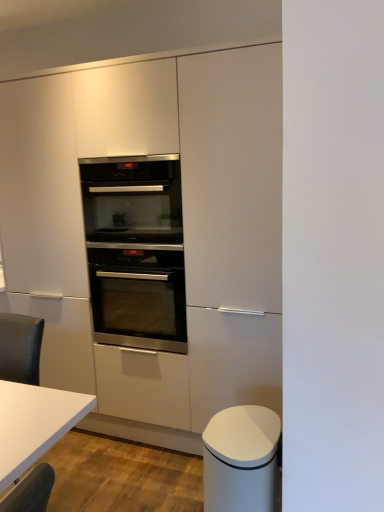
Where is `stainless steel oven at center, which appears as the first oven when viewed from the top`? This screenshot has width=384, height=512. stainless steel oven at center, which appears as the first oven when viewed from the top is located at coordinates (132, 199).

This screenshot has height=512, width=384. What do you see at coordinates (34, 423) in the screenshot? I see `white glossy table at lower left` at bounding box center [34, 423].

Locate an element on the screen. Image resolution: width=384 pixels, height=512 pixels. white matte trash can at lower right, marked as the 2th cabinetry in a back-to-front arrangement is located at coordinates (241, 460).

Between satin white cabinet at center, the first cabinetry when ordered from back to front, and stainless steel oven at center, which ranks as the second oven in bottom-to-top order, which one appears on the left side from the viewer's perspective?

stainless steel oven at center, which ranks as the second oven in bottom-to-top order.

Could you measure the distance between satin white cabinet at center, the first cabinetry when ordered from back to front, and stainless steel oven at center, which ranks as the second oven in bottom-to-top order?

A distance of 10.11 inches exists between satin white cabinet at center, the first cabinetry when ordered from back to front, and stainless steel oven at center, which ranks as the second oven in bottom-to-top order.

Considering their positions, is satin white cabinet at center, the 2th cabinetry viewed from the front, located in front of or behind stainless steel oven at center, which appears as the first oven when viewed from the top?

satin white cabinet at center, the 2th cabinetry viewed from the front, is positioned closer to the viewer than stainless steel oven at center, which appears as the first oven when viewed from the top.

Is stainless steel oven at center, which ranks as the second oven in bottom-to-top order, at the back of satin white cabinet at center, the 2th cabinetry viewed from the front?

Yes, stainless steel oven at center, which ranks as the second oven in bottom-to-top order, is at the back of satin white cabinet at center, the 2th cabinetry viewed from the front.

Considering the sizes of objects stainless steel oven at center, acting as the second oven starting from the top, and satin white cabinet at center, the first cabinetry when ordered from back to front, in the image provided, who is taller, stainless steel oven at center, acting as the second oven starting from the top, or satin white cabinet at center, the first cabinetry when ordered from back to front,?

With more height is satin white cabinet at center, the first cabinetry when ordered from back to front.

Considering their positions, is stainless steel oven at center, acting as the second oven starting from the top, located in front of or behind satin white cabinet at center, the 2th cabinetry viewed from the front?

Clearly, stainless steel oven at center, acting as the second oven starting from the top, is behind satin white cabinet at center, the 2th cabinetry viewed from the front.

Which of these two, stainless steel oven at center, positioned as the 1th oven in bottom-to-top order, or satin white cabinet at center, the 2th cabinetry viewed from the front, is wider?

Wider between the two is satin white cabinet at center, the 2th cabinetry viewed from the front.

At what (x,y) coordinates should I click in order to perform the action: click on oven in front of the stainless steel oven at center, positioned as the 1th oven in bottom-to-top order. Please return your answer as a coordinate pair (x, y). The width and height of the screenshot is (384, 512). Looking at the image, I should click on (132, 199).

From a real-world perspective, does stainless steel oven at center, acting as the second oven starting from the top, stand above stainless steel oven at center, which appears as the first oven when viewed from the top?

No, from a real-world perspective, stainless steel oven at center, acting as the second oven starting from the top, is not over stainless steel oven at center, which appears as the first oven when viewed from the top

From the image's perspective, which one is positioned higher, stainless steel oven at center, positioned as the 1th oven in bottom-to-top order, or stainless steel oven at center, which ranks as the second oven in bottom-to-top order?

stainless steel oven at center, which ranks as the second oven in bottom-to-top order.

What's the angular difference between stainless steel oven at center, positioned as the 1th oven in bottom-to-top order, and stainless steel oven at center, which appears as the first oven when viewed from the top,'s facing directions?

The angular difference between stainless steel oven at center, positioned as the 1th oven in bottom-to-top order, and stainless steel oven at center, which appears as the first oven when viewed from the top, is 0.0645 degrees.

Find the location of `oven that appears below the stainless steel oven at center, which ranks as the second oven in bottom-to-top order (from the image's perspective)`. oven that appears below the stainless steel oven at center, which ranks as the second oven in bottom-to-top order (from the image's perspective) is located at coordinates (138, 295).

Is stainless steel oven at center, which appears as the first oven when viewed from the top, taller than stainless steel oven at center, acting as the second oven starting from the top?

Incorrect, the height of stainless steel oven at center, which appears as the first oven when viewed from the top, is not larger of that of stainless steel oven at center, acting as the second oven starting from the top.

Which object is more forward, stainless steel oven at center, which appears as the first oven when viewed from the top, or stainless steel oven at center, positioned as the 1th oven in bottom-to-top order?

stainless steel oven at center, which appears as the first oven when viewed from the top, is in front.

How different are the orientations of stainless steel oven at center, which appears as the first oven when viewed from the top, and stainless steel oven at center, positioned as the 1th oven in bottom-to-top order, in degrees?

There is a 0.0645-degree angle between the facing directions of stainless steel oven at center, which appears as the first oven when viewed from the top, and stainless steel oven at center, positioned as the 1th oven in bottom-to-top order.

Which is behind, point (252, 477) or point (212, 376)?

Positioned behind is point (212, 376).

Which of these two, white matte trash can at lower right, the first cabinetry from the front, or satin white cabinet at center, the 2th cabinetry viewed from the front, is thinner?

With smaller width is white matte trash can at lower right, the first cabinetry from the front.

From a real-world perspective, which is physically above, white matte trash can at lower right, marked as the 2th cabinetry in a back-to-front arrangement, or satin white cabinet at center, the first cabinetry when ordered from back to front?

In real-world perspective, satin white cabinet at center, the first cabinetry when ordered from back to front, is above.

Is white matte trash can at lower right, marked as the 2th cabinetry in a back-to-front arrangement, facing towards satin white cabinet at center, the 2th cabinetry viewed from the front?

No.

Consider the image. From the image's perspective, is satin white cabinet at center, the first cabinetry when ordered from back to front, located beneath white glossy table at lower left?

No, from the image's perspective, satin white cabinet at center, the first cabinetry when ordered from back to front, is not below white glossy table at lower left.

Considering the sizes of objects satin white cabinet at center, the first cabinetry when ordered from back to front, and white glossy table at lower left in the image provided, who is wider, satin white cabinet at center, the first cabinetry when ordered from back to front, or white glossy table at lower left?

satin white cabinet at center, the first cabinetry when ordered from back to front, is wider.

How many degrees apart are the facing directions of satin white cabinet at center, the first cabinetry when ordered from back to front, and white glossy table at lower left?

The angle between the facing direction of satin white cabinet at center, the first cabinetry when ordered from back to front, and the facing direction of white glossy table at lower left is 0.893 degrees.

Is the surface of satin white cabinet at center, the first cabinetry when ordered from back to front, in direct contact with white glossy table at lower left?

There is a gap between satin white cabinet at center, the first cabinetry when ordered from back to front, and white glossy table at lower left.

Is white matte trash can at lower right, the first cabinetry from the front, positioned with its back to stainless steel oven at center, positioned as the 1th oven in bottom-to-top order?

No, white matte trash can at lower right, the first cabinetry from the front, is not facing the opposite direction of stainless steel oven at center, positioned as the 1th oven in bottom-to-top order.

What's the angular difference between white matte trash can at lower right, marked as the 2th cabinetry in a back-to-front arrangement, and stainless steel oven at center, positioned as the 1th oven in bottom-to-top order,'s facing directions?

The facing directions of white matte trash can at lower right, marked as the 2th cabinetry in a back-to-front arrangement, and stainless steel oven at center, positioned as the 1th oven in bottom-to-top order, are 90.2 degrees apart.

Which is correct: white matte trash can at lower right, marked as the 2th cabinetry in a back-to-front arrangement, is inside stainless steel oven at center, acting as the second oven starting from the top, or outside of it?

The correct answer is: outside.

From the image's perspective, between white matte trash can at lower right, marked as the 2th cabinetry in a back-to-front arrangement, and stainless steel oven at center, positioned as the 1th oven in bottom-to-top order, who is located below?

From the image's view, white matte trash can at lower right, marked as the 2th cabinetry in a back-to-front arrangement, is below.

From the image's perspective, starting from the stainless steel oven at center, which appears as the first oven when viewed from the top, which cabinetry is the 1st one below? Please provide its 2D coordinates.

[(150, 234)]

The width and height of the screenshot is (384, 512). In order to click on the 1st cabinetry in front of the stainless steel oven at center, acting as the second oven starting from the top in this screenshot , I will do `click(150, 234)`.

In the scene shown: Estimate the real-world distances between objects in this image. Which object is further from stainless steel oven at center, which appears as the first oven when viewed from the top, white matte trash can at lower right, marked as the 2th cabinetry in a back-to-front arrangement, or stainless steel oven at center, positioned as the 1th oven in bottom-to-top order?

Among the two, white matte trash can at lower right, marked as the 2th cabinetry in a back-to-front arrangement, is located further to stainless steel oven at center, which appears as the first oven when viewed from the top.

When comparing their distances from satin white cabinet at center, the 2th cabinetry viewed from the front, does stainless steel oven at center, positioned as the 1th oven in bottom-to-top order, or white matte trash can at lower right, the first cabinetry from the front, seem closer?

Among the two, stainless steel oven at center, positioned as the 1th oven in bottom-to-top order, is located nearer to satin white cabinet at center, the 2th cabinetry viewed from the front.

Based on the photo, based on their spatial positions, is white matte trash can at lower right, the first cabinetry from the front, or stainless steel oven at center, acting as the second oven starting from the top, further from white glossy table at lower left?

stainless steel oven at center, acting as the second oven starting from the top, is positioned further to the anchor white glossy table at lower left.

Estimate the real-world distances between objects in this image. Which object is closer to stainless steel oven at center, which ranks as the second oven in bottom-to-top order, stainless steel oven at center, acting as the second oven starting from the top, or satin white cabinet at center, the 2th cabinetry viewed from the front?

satin white cabinet at center, the 2th cabinetry viewed from the front, lies closer to stainless steel oven at center, which ranks as the second oven in bottom-to-top order, than the other object.

From the image, which object appears to be nearer to satin white cabinet at center, the 2th cabinetry viewed from the front, stainless steel oven at center, which ranks as the second oven in bottom-to-top order, or stainless steel oven at center, positioned as the 1th oven in bottom-to-top order?

stainless steel oven at center, positioned as the 1th oven in bottom-to-top order.

Looking at the image, which one is located closer to satin white cabinet at center, the 2th cabinetry viewed from the front, white glossy table at lower left or white matte trash can at lower right, marked as the 2th cabinetry in a back-to-front arrangement?

The object closer to satin white cabinet at center, the 2th cabinetry viewed from the front, is white matte trash can at lower right, marked as the 2th cabinetry in a back-to-front arrangement.

From the image, which object appears to be nearer to white matte trash can at lower right, marked as the 2th cabinetry in a back-to-front arrangement, stainless steel oven at center, which ranks as the second oven in bottom-to-top order, or satin white cabinet at center, the first cabinetry when ordered from back to front?

Based on the image, satin white cabinet at center, the first cabinetry when ordered from back to front, appears to be nearer to white matte trash can at lower right, marked as the 2th cabinetry in a back-to-front arrangement.

In the scene shown: When comparing their distances from satin white cabinet at center, the 2th cabinetry viewed from the front, does stainless steel oven at center, which ranks as the second oven in bottom-to-top order, or white glossy table at lower left seem closer?

Based on the image, stainless steel oven at center, which ranks as the second oven in bottom-to-top order, appears to be nearer to satin white cabinet at center, the 2th cabinetry viewed from the front.

Identify the location of cabinetry between stainless steel oven at center, which ranks as the second oven in bottom-to-top order, and white glossy table at lower left from top to bottom. (150, 234).

Image resolution: width=384 pixels, height=512 pixels. I want to click on oven between stainless steel oven at center, which ranks as the second oven in bottom-to-top order, and white glossy table at lower left from top to bottom, so click(138, 295).

You are a GUI agent. You are given a task and a screenshot of the screen. Output one action in this format:
    pyautogui.click(x=<x>, y=<y>)
    Task: Click on the table between stainless steel oven at center, which ranks as the second oven in bottom-to-top order, and white matte trash can at lower right, the first cabinetry from the front, from top to bottom
    Image resolution: width=384 pixels, height=512 pixels.
    Given the screenshot: What is the action you would take?
    pyautogui.click(x=34, y=423)

At what (x,y) coordinates should I click in order to perform the action: click on cabinetry between stainless steel oven at center, which ranks as the second oven in bottom-to-top order, and stainless steel oven at center, acting as the second oven starting from the top, from top to bottom. Please return your answer as a coordinate pair (x, y). The width and height of the screenshot is (384, 512). Looking at the image, I should click on (150, 234).